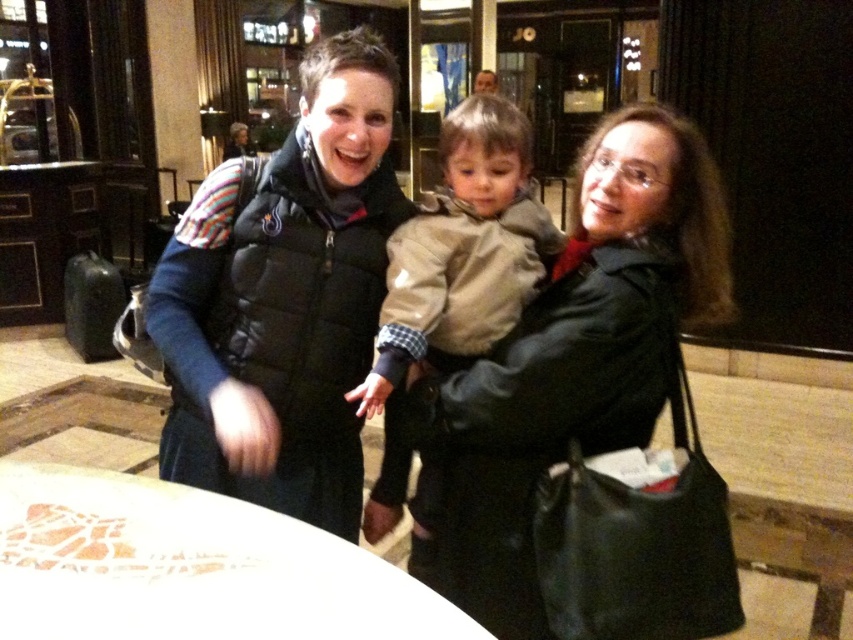
You are a photographer trying to capture a group photo of the black puffer vest at center and the tan fabric jacket at center. Which of the two should you focus on first if you want to ensure the larger one is in sharp focus?

The black puffer vest at center is larger than the tan fabric jacket at center, so you should focus on the black puffer vest at center first to ensure it is in sharp focus.

You are a photographer trying to capture a candid shot of the two people at the center of the image. The matte black coat at center and the tan fabric jacket at center are both in your frame. Based on their positions, which one is closer to the left edge of your camera view?

The tan fabric jacket at center is closer to the left edge because the matte black coat at center is positioned to the right of it.

You are a photographer trying to capture a group photo of the tan fabric jacket at center and the smooth brown hair at upper center. Which object should you focus on first if you want to ensure both are in focus, considering their sizes?

The tan fabric jacket at center is larger than the smooth brown hair at upper center, so focusing on the tan fabric jacket at center first would help ensure both are in focus.